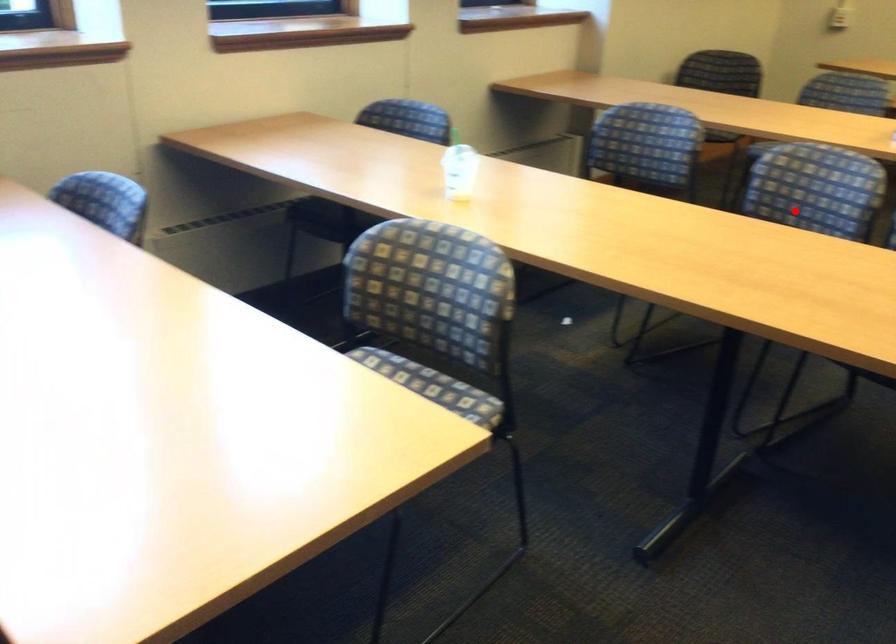
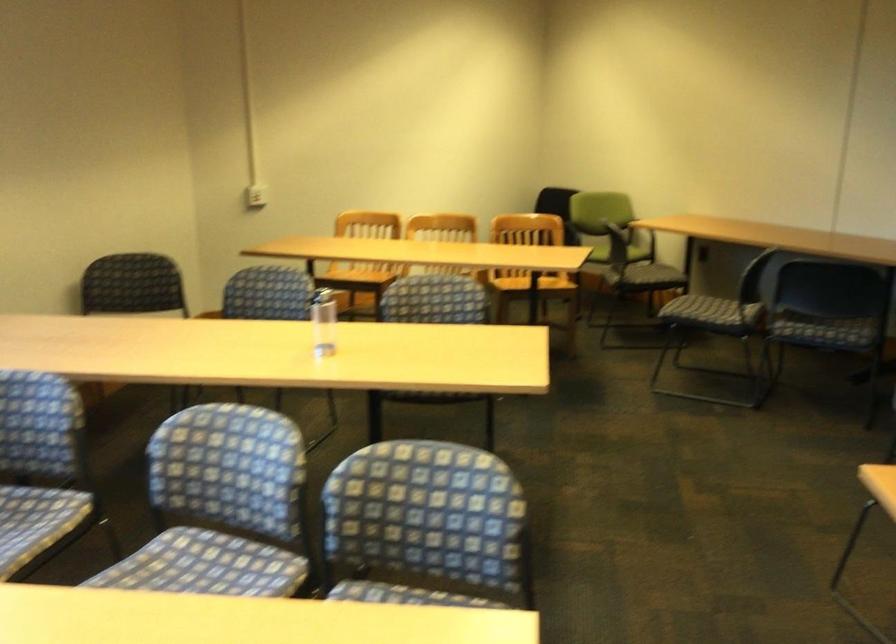
Question: A red point is marked in image1. In image2, is the corresponding 3D point closer to the camera or farther? Reply with the corresponding letter.

Choices:
 (A) The corresponding 3D point is closer.
 (B) The corresponding 3D point is farther.

Answer: (A)